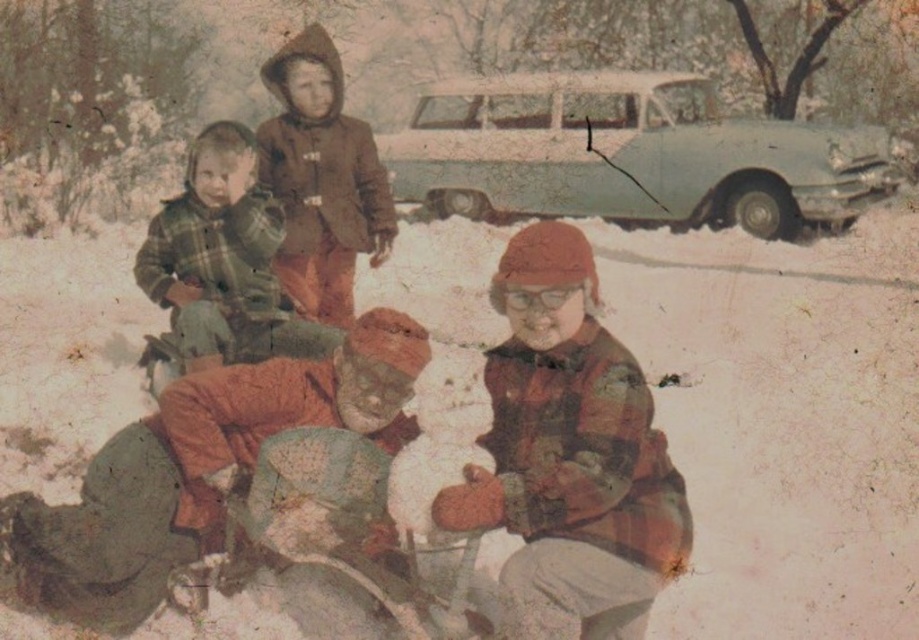
Which is more to the right, light blue metallic car at upper center or green plaid shirt at left?

light blue metallic car at upper center is more to the right.

Does light blue metallic car at upper center have a larger size compared to green plaid shirt at left?

Yes, light blue metallic car at upper center is bigger than green plaid shirt at left.

Is point (827, 161) positioned in front of point (199, 176)?

That is False.

At what (x,y) coordinates should I click in order to perform the action: click on light blue metallic car at upper center. Please return your answer as a coordinate pair (x, y). This screenshot has height=640, width=919. Looking at the image, I should click on (628, 154).

Who is lower down, flannel shirt at center or green plaid shirt at left?

Positioned lower is flannel shirt at center.

From the picture: Is flannel shirt at center to the right of green plaid shirt at left from the viewer's perspective?

Correct, you'll find flannel shirt at center to the right of green plaid shirt at left.

Between point (256, 488) and point (188, 355), which one is positioned in front?

Point (256, 488) is more forward.

Locate an element on the screen. The image size is (919, 640). flannel shirt at center is located at coordinates (231, 486).

Between point (57, 577) and point (546, 509), which one is positioned in front?

Positioned in front is point (546, 509).

Can you confirm if flannel shirt at center is wider than plaid flannel shirt at center?

Yes.

Who is more forward, (x=367, y=532) or (x=664, y=564)?

Point (x=664, y=564) is more forward.

Identify the location of flannel shirt at center. This screenshot has height=640, width=919. 231,486.